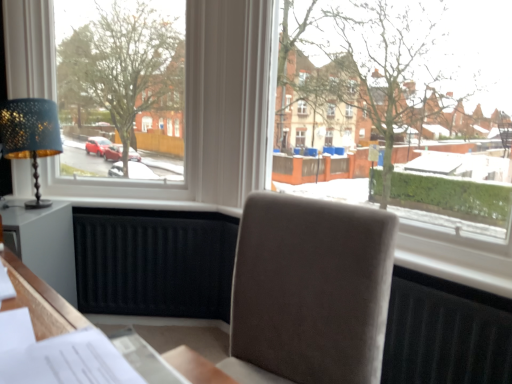
At what (x,y) coordinates should I click in order to perform the action: click on matte gold table lamp at left. Please return your answer as a coordinate pair (x, y). Looking at the image, I should click on (30, 135).

You are a GUI agent. You are given a task and a screenshot of the screen. Output one action in this format:
    pyautogui.click(x=<x>, y=<y>)
    Task: Click on the white wood table at lower left
    
    Given the screenshot: What is the action you would take?
    coord(44,244)

Can you confirm if matte gold table lamp at left is thinner than white wood table at lower left?

Correct, the width of matte gold table lamp at left is less than that of white wood table at lower left.

Does matte gold table lamp at left turn towards white wood table at lower left?

No, matte gold table lamp at left is not turned towards white wood table at lower left.

How distant is matte gold table lamp at left from white wood table at lower left?

matte gold table lamp at left and white wood table at lower left are 10.59 inches apart from each other.

Which of these two, matte gold table lamp at left or white wood table at lower left, stands taller?

With more height is white wood table at lower left.

Based on the photo, considering the positions of objects suede-like beige chair at center and white wood table at lower left in the image provided, who is more to the right, suede-like beige chair at center or white wood table at lower left?

suede-like beige chair at center.

In terms of size, does suede-like beige chair at center appear bigger or smaller than white wood table at lower left?

In the image, suede-like beige chair at center appears to be larger than white wood table at lower left.

I want to click on chair on the right of the white wood table at lower left, so click(x=309, y=292).

Looking at this image, from the image's perspective, is suede-like beige chair at center beneath white wood table at lower left?

Yes, from the image's perspective, suede-like beige chair at center is below white wood table at lower left.

Would you consider white wood table at lower left to be distant from white plastic window at upper left, the 2th window positioned from the right?

No.

Is white wood table at lower left positioned with its back to white plastic window at upper left, the 2th window positioned from the right?

No, white wood table at lower left is not facing the opposite direction of white plastic window at upper left, the 2th window positioned from the right.

From the image's perspective, is white wood table at lower left positioned above or below white plastic window at upper left, the 2th window positioned from the right?

white wood table at lower left is situated lower than white plastic window at upper left, the 2th window positioned from the right, in the image.

Is point (12, 214) farther from viewer compared to point (24, 5)?

No.

Which point is more distant from viewer, (x=31, y=133) or (x=200, y=97)?

Point (x=200, y=97)

From a real-world perspective, between matte gold table lamp at left and white plastic window at upper left, the 2th window positioned from the right, who is vertically lower?

matte gold table lamp at left.

Which of these two, matte gold table lamp at left or white plastic window at upper left, which is counted as the first window, starting from the left, is smaller?

matte gold table lamp at left.

Is matte gold table lamp at left situated inside white plastic window at upper left, which is counted as the first window, starting from the left, or outside?

matte gold table lamp at left cannot be found inside white plastic window at upper left, which is counted as the first window, starting from the left.

From the image's perspective, which one is positioned lower, matte gold table lamp at left or white paper at lower left?

white paper at lower left appears lower in the image.

Is matte gold table lamp at left not near white paper at lower left?

That's right, there is a large distance between matte gold table lamp at left and white paper at lower left.

Which is behind, matte gold table lamp at left or white paper at lower left?

matte gold table lamp at left is more distant.

Considering the sizes of objects matte gold table lamp at left and white paper at lower left in the image provided, who is bigger, matte gold table lamp at left or white paper at lower left?

matte gold table lamp at left is bigger.

Which of these two, transparent glass window at center, placed as the 1th window when sorted from right to left, or matte gold table lamp at left, stands shorter?

With less height is matte gold table lamp at left.

Does point (490, 219) come farther from viewer compared to point (34, 126)?

That is False.

From a real-world perspective, which is physically above, transparent glass window at center, placed as the 1th window when sorted from right to left, or matte gold table lamp at left?

In real-world perspective, transparent glass window at center, placed as the 1th window when sorted from right to left, is above.

Can you confirm if white plastic window at upper left, the 2th window positioned from the right, is thinner than suede-like beige chair at center?

Yes.

Is white plastic window at upper left, the 2th window positioned from the right, far away from suede-like beige chair at center?

white plastic window at upper left, the 2th window positioned from the right, is far away from suede-like beige chair at center.

From a real-world perspective, which object rests below the other?

In real-world perspective, suede-like beige chair at center is lower.

Between point (100, 190) and point (220, 363), which one is positioned behind?

The point (100, 190) is farther from the camera.

I want to click on table lying below the matte gold table lamp at left (from the image's perspective), so click(44, 244).

Locate an element on the screen. chair on the right of white wood table at lower left is located at coordinates (309, 292).

When comparing their distances from transparent glass window at center, acting as the 2th window starting from the left, does suede-like beige chair at center or white wood table at lower left seem closer?

suede-like beige chair at center is positioned closer to the anchor transparent glass window at center, acting as the 2th window starting from the left.

When comparing their distances from white wood table at lower left, does suede-like beige chair at center or transparent glass window at center, acting as the 2th window starting from the left, seem further?

Among the two, transparent glass window at center, acting as the 2th window starting from the left, is located further to white wood table at lower left.

Looking at the image, which one is located closer to matte gold table lamp at left, suede-like beige chair at center or white wood table at lower left?

Based on the image, white wood table at lower left appears to be nearer to matte gold table lamp at left.

When comparing their distances from white plastic window at upper left, the 2th window positioned from the right, does white wood table at lower left or suede-like beige chair at center seem closer?

white wood table at lower left is closer to white plastic window at upper left, the 2th window positioned from the right.

Looking at the image, which one is located further to matte gold table lamp at left, white paper at lower left or transparent glass window at center, acting as the 2th window starting from the left?

Based on the image, transparent glass window at center, acting as the 2th window starting from the left, appears to be further to matte gold table lamp at left.

Considering their positions, is white paper at lower left positioned closer to matte gold table lamp at left than suede-like beige chair at center?

Based on the image, white paper at lower left appears to be nearer to matte gold table lamp at left.

Based on their spatial positions, is suede-like beige chair at center or white paper at lower left further from white wood table at lower left?

suede-like beige chair at center is further to white wood table at lower left.

Which object lies further to the anchor point white paper at lower left, suede-like beige chair at center or matte gold table lamp at left?

Based on the image, matte gold table lamp at left appears to be further to white paper at lower left.

Identify the location of table lamp between white plastic window at upper left, which is counted as the first window, starting from the left, and white wood table at lower left, in the vertical direction. Image resolution: width=512 pixels, height=384 pixels. (30, 135).

The height and width of the screenshot is (384, 512). I want to click on window between matte gold table lamp at left and transparent glass window at center, acting as the 2th window starting from the left, from left to right, so click(145, 147).

Where is `window situated between white wood table at lower left and transparent glass window at center, acting as the 2th window starting from the left, from left to right`? window situated between white wood table at lower left and transparent glass window at center, acting as the 2th window starting from the left, from left to right is located at coordinates (145, 147).

At what (x,y) coordinates should I click in order to perform the action: click on table between suede-like beige chair at center and matte gold table lamp at left in the front-back direction. Please return your answer as a coordinate pair (x, y). Image resolution: width=512 pixels, height=384 pixels. Looking at the image, I should click on tap(44, 244).